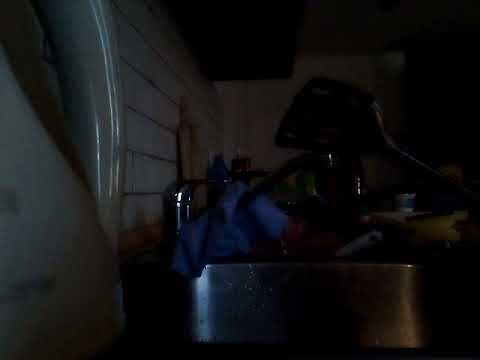
This screenshot has width=480, height=360. I want to click on dishes, so click(390, 138), click(286, 248), click(363, 195), click(408, 223).